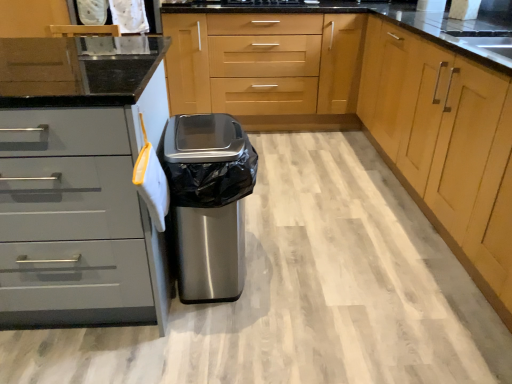
The height and width of the screenshot is (384, 512). In order to click on light wood cabinet at center, the third cabinetry positioned from the right in this screenshot , I will do `click(267, 67)`.

Identify the location of stainless steel trash can at center. (209, 202).

Identify the location of brushed metal cabinet at center, which ranks as the second cabinetry in right-to-left order. (369, 110).

Measure the distance between point [468,245] and camera.

They are 1.71 meters apart.

Identify the location of matte gray drawers at left, which is the 4th cabinetry from right to left. The width and height of the screenshot is (512, 384). (81, 185).

Find the location of a particular element. Image resolution: width=512 pixels, height=384 pixels. light wood cabinet at center, the third cabinetry positioned from the right is located at coordinates (267, 67).

From the image's perspective, which is below, light wood cabinet at center, placed as the 4th cabinetry when sorted from left to right, or matte gray drawers at left, arranged as the first cabinetry when viewed from the left?

matte gray drawers at left, arranged as the first cabinetry when viewed from the left, from the image's perspective.

In the image, is light wood cabinet at center, which appears as the first cabinetry when viewed from the right, positioned in front of or behind matte gray drawers at left, which is the 4th cabinetry from right to left?

In the image, light wood cabinet at center, which appears as the first cabinetry when viewed from the right, appears in front of matte gray drawers at left, which is the 4th cabinetry from right to left.

Considering the relative positions of light wood cabinet at center, placed as the 4th cabinetry when sorted from left to right, and matte gray drawers at left, arranged as the first cabinetry when viewed from the left, in the image provided, is light wood cabinet at center, placed as the 4th cabinetry when sorted from left to right, to the left of matte gray drawers at left, arranged as the first cabinetry when viewed from the left, from the viewer's perspective?

No.

Which point is more forward, (456,81) or (41,191)?

The point (41,191) is more forward.

Considering the relative sizes of brushed metal cabinet at center, which ranks as the second cabinetry in right-to-left order, and matte gray drawers at left, which is the 4th cabinetry from right to left, in the image provided, is brushed metal cabinet at center, which ranks as the second cabinetry in right-to-left order, wider than matte gray drawers at left, which is the 4th cabinetry from right to left,?

Yes, brushed metal cabinet at center, which ranks as the second cabinetry in right-to-left order, is wider than matte gray drawers at left, which is the 4th cabinetry from right to left.

Considering the positions of point (282, 69) and point (73, 111), is point (282, 69) closer or farther from the camera than point (73, 111)?

Point (282, 69).

From the matte gray drawers at left, which is the 4th cabinetry from right to left, count 2nd cabinetrys forward and point to it. Please provide its 2D coordinates.

[(369, 110)]

In terms of height, does brushed metal cabinet at center, marked as the third cabinetry in a left-to-right arrangement, look taller or shorter compared to matte gray drawers at left, arranged as the first cabinetry when viewed from the left?

In the image, brushed metal cabinet at center, marked as the third cabinetry in a left-to-right arrangement, appears to be taller than matte gray drawers at left, arranged as the first cabinetry when viewed from the left.

Looking at this image, is light wood cabinet at center, the third cabinetry positioned from the right, oriented away from stainless steel trash can at center?

No, light wood cabinet at center, the third cabinetry positioned from the right, is not facing away from stainless steel trash can at center.

Looking at this image, how many degrees apart are the facing directions of light wood cabinet at center, the third cabinetry positioned from the right, and stainless steel trash can at center?

They differ by 91.3 degrees in their facing directions.

This screenshot has height=384, width=512. Find the location of `home appliance below the light wood cabinet at center, which is the second cabinetry from left to right (from the image's perspective)`. home appliance below the light wood cabinet at center, which is the second cabinetry from left to right (from the image's perspective) is located at coordinates (209, 202).

Is there a large distance between light wood cabinet at center, which is the second cabinetry from left to right, and brushed metal cabinet at center, which ranks as the second cabinetry in right-to-left order?

Actually, light wood cabinet at center, which is the second cabinetry from left to right, and brushed metal cabinet at center, which ranks as the second cabinetry in right-to-left order, are a little close together.

Is light wood cabinet at center, the third cabinetry positioned from the right, taller than brushed metal cabinet at center, which ranks as the second cabinetry in right-to-left order?

No, light wood cabinet at center, the third cabinetry positioned from the right, is not taller than brushed metal cabinet at center, which ranks as the second cabinetry in right-to-left order.

Is light wood cabinet at center, the third cabinetry positioned from the right, further to camera compared to brushed metal cabinet at center, marked as the third cabinetry in a left-to-right arrangement?

Yes.

From the image's perspective, which is below, light wood cabinet at center, which is the second cabinetry from left to right, or brushed metal cabinet at center, which ranks as the second cabinetry in right-to-left order?

brushed metal cabinet at center, which ranks as the second cabinetry in right-to-left order.

Does light wood cabinet at center, which appears as the first cabinetry when viewed from the right, appear on the left side of brushed metal cabinet at center, which ranks as the second cabinetry in right-to-left order?

No.

What's the angular difference between light wood cabinet at center, which appears as the first cabinetry when viewed from the right, and brushed metal cabinet at center, marked as the third cabinetry in a left-to-right arrangement,'s facing directions?

90 degrees.

Is light wood cabinet at center, placed as the 4th cabinetry when sorted from left to right, in front of or behind brushed metal cabinet at center, which ranks as the second cabinetry in right-to-left order, in the image?

light wood cabinet at center, placed as the 4th cabinetry when sorted from left to right, is positioned farther from the viewer than brushed metal cabinet at center, which ranks as the second cabinetry in right-to-left order.

Considering the sizes of light wood cabinet at center, which appears as the first cabinetry when viewed from the right, and brushed metal cabinet at center, which ranks as the second cabinetry in right-to-left order, in the image, is light wood cabinet at center, which appears as the first cabinetry when viewed from the right, wider or thinner than brushed metal cabinet at center, which ranks as the second cabinetry in right-to-left order,?

light wood cabinet at center, which appears as the first cabinetry when viewed from the right, is thinner than brushed metal cabinet at center, which ranks as the second cabinetry in right-to-left order.

Between point (233, 111) and point (474, 236), which one is positioned in front?

Point (474, 236)

From a real-world perspective, is light wood cabinet at center, the third cabinetry positioned from the right, positioned under light wood cabinet at center, which appears as the first cabinetry when viewed from the right, based on gravity?

Yes, from a real-world perspective, light wood cabinet at center, the third cabinetry positioned from the right, is beneath light wood cabinet at center, which appears as the first cabinetry when viewed from the right.

Is light wood cabinet at center, the third cabinetry positioned from the right, facing away from light wood cabinet at center, placed as the 4th cabinetry when sorted from left to right?

No, light wood cabinet at center, placed as the 4th cabinetry when sorted from left to right, is not at the back of light wood cabinet at center, the third cabinetry positioned from the right.

Consider the image. Choose the correct answer: Is light wood cabinet at center, the third cabinetry positioned from the right, inside light wood cabinet at center, which appears as the first cabinetry when viewed from the right, or outside it?

light wood cabinet at center, the third cabinetry positioned from the right, is spatially situated outside light wood cabinet at center, which appears as the first cabinetry when viewed from the right.

In terms of height, does brushed metal cabinet at center, marked as the third cabinetry in a left-to-right arrangement, look taller or shorter compared to light wood cabinet at center, which is the second cabinetry from left to right?

brushed metal cabinet at center, marked as the third cabinetry in a left-to-right arrangement, is taller than light wood cabinet at center, which is the second cabinetry from left to right.

Considering the positions of point (446, 83) and point (324, 75), is point (446, 83) closer or farther from the camera than point (324, 75)?

Clearly, point (446, 83) is closer to the camera than point (324, 75).

Is brushed metal cabinet at center, which ranks as the second cabinetry in right-to-left order, aimed at light wood cabinet at center, which is the second cabinetry from left to right?

No.

Considering their positions, is brushed metal cabinet at center, marked as the third cabinetry in a left-to-right arrangement, located in front of or behind light wood cabinet at center, which is the second cabinetry from left to right?

In the image, brushed metal cabinet at center, marked as the third cabinetry in a left-to-right arrangement, appears in front of light wood cabinet at center, which is the second cabinetry from left to right.

Where is `cabinetry positioned vertically above the light wood cabinet at center, placed as the 4th cabinetry when sorted from left to right (from a real-world perspective)`? The height and width of the screenshot is (384, 512). cabinetry positioned vertically above the light wood cabinet at center, placed as the 4th cabinetry when sorted from left to right (from a real-world perspective) is located at coordinates (81, 185).

Which cabinetry is the 2nd one when counting from the right side of the matte gray drawers at left, arranged as the first cabinetry when viewed from the left? Please provide its 2D coordinates.

[(369, 110)]

From the picture: Estimate the real-world distances between objects in this image. Which object is further from light wood cabinet at center, which is the second cabinetry from left to right, brushed metal cabinet at center, which ranks as the second cabinetry in right-to-left order, or stainless steel trash can at center?

Among the two, stainless steel trash can at center is located further to light wood cabinet at center, which is the second cabinetry from left to right.

Estimate the real-world distances between objects in this image. Which object is further from light wood cabinet at center, which appears as the first cabinetry when viewed from the right, matte gray drawers at left, which is the 4th cabinetry from right to left, or brushed metal cabinet at center, which ranks as the second cabinetry in right-to-left order?

Among the two, matte gray drawers at left, which is the 4th cabinetry from right to left, is located further to light wood cabinet at center, which appears as the first cabinetry when viewed from the right.

Looking at the image, which one is located closer to brushed metal cabinet at center, marked as the third cabinetry in a left-to-right arrangement, light wood cabinet at center, placed as the 4th cabinetry when sorted from left to right, or light wood cabinet at center, which is the second cabinetry from left to right?

light wood cabinet at center, which is the second cabinetry from left to right, is closer to brushed metal cabinet at center, marked as the third cabinetry in a left-to-right arrangement.

Based on their spatial positions, is light wood cabinet at center, which is the second cabinetry from left to right, or brushed metal cabinet at center, which ranks as the second cabinetry in right-to-left order, closer to matte gray drawers at left, which is the 4th cabinetry from right to left?

brushed metal cabinet at center, which ranks as the second cabinetry in right-to-left order, is closer to matte gray drawers at left, which is the 4th cabinetry from right to left.

Looking at the image, which one is located further to brushed metal cabinet at center, which ranks as the second cabinetry in right-to-left order, light wood cabinet at center, which appears as the first cabinetry when viewed from the right, or stainless steel trash can at center?

stainless steel trash can at center lies further to brushed metal cabinet at center, which ranks as the second cabinetry in right-to-left order, than the other object.

When comparing their distances from matte gray drawers at left, arranged as the first cabinetry when viewed from the left, does light wood cabinet at center, which appears as the first cabinetry when viewed from the right, or brushed metal cabinet at center, which ranks as the second cabinetry in right-to-left order, seem closer?

light wood cabinet at center, which appears as the first cabinetry when viewed from the right.

From the image, which object appears to be farther from stainless steel trash can at center, brushed metal cabinet at center, which ranks as the second cabinetry in right-to-left order, or light wood cabinet at center, which appears as the first cabinetry when viewed from the right?

brushed metal cabinet at center, which ranks as the second cabinetry in right-to-left order, is positioned further to the anchor stainless steel trash can at center.

Which object lies further to the anchor point light wood cabinet at center, the third cabinetry positioned from the right, light wood cabinet at center, placed as the 4th cabinetry when sorted from left to right, or stainless steel trash can at center?

stainless steel trash can at center is further to light wood cabinet at center, the third cabinetry positioned from the right.

Image resolution: width=512 pixels, height=384 pixels. Identify the location of home appliance between light wood cabinet at center, which appears as the first cabinetry when viewed from the right, and light wood cabinet at center, which is the second cabinetry from left to right, in the front-back direction. (209, 202).

Find the location of a particular element. The width and height of the screenshot is (512, 384). home appliance situated between matte gray drawers at left, arranged as the first cabinetry when viewed from the left, and light wood cabinet at center, placed as the 4th cabinetry when sorted from left to right, from left to right is located at coordinates (209, 202).

Where is `home appliance between matte gray drawers at left, arranged as the first cabinetry when viewed from the left, and light wood cabinet at center, which is the second cabinetry from left to right, in the front-back direction`? home appliance between matte gray drawers at left, arranged as the first cabinetry when viewed from the left, and light wood cabinet at center, which is the second cabinetry from left to right, in the front-back direction is located at coordinates (209, 202).

Locate an element on the screen. The height and width of the screenshot is (384, 512). home appliance between brushed metal cabinet at center, which ranks as the second cabinetry in right-to-left order, and light wood cabinet at center, the third cabinetry positioned from the right, along the z-axis is located at coordinates (209, 202).